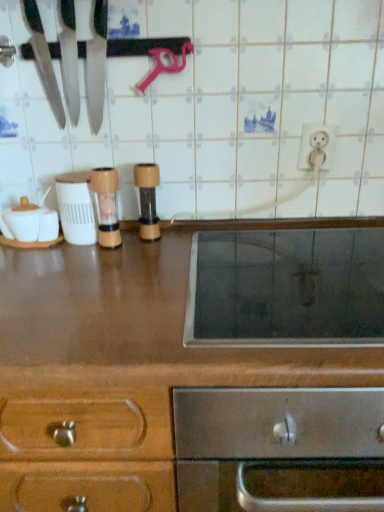
How much space does shiny silver knife at upper left, acting as the first knife starting from the left, occupy vertically?

shiny silver knife at upper left, acting as the first knife starting from the left, is 13.19 inches tall.

Describe the element at coordinates (42, 59) in the screenshot. I see `shiny silver knife at upper left, marked as the 2th knife in a right-to-left arrangement` at that location.

Measure the distance between wooden pepper grinder at center, the second appliance in the left-to-right sequence, and camera.

A distance of 36.05 inches exists between wooden pepper grinder at center, the second appliance in the left-to-right sequence, and camera.

The width and height of the screenshot is (384, 512). What do you see at coordinates (69, 57) in the screenshot? I see `shiny silver knife at upper left, which ranks as the 2th knife in left-to-right order` at bounding box center [69, 57].

What is the approximate height of white plastic container at center, which is the first appliance from left to right?

The height of white plastic container at center, which is the first appliance from left to right, is 6.97 inches.

The width and height of the screenshot is (384, 512). Describe the element at coordinates (317, 147) in the screenshot. I see `white glossy electric outlet at upper right` at that location.

What do you see at coordinates (147, 199) in the screenshot?
I see `brown wood pepper grinder at center, which appears as the third appliance when viewed from the left` at bounding box center [147, 199].

Where is `shiny silver knife at upper left, marked as the 2th knife in a right-to-left arrangement`? shiny silver knife at upper left, marked as the 2th knife in a right-to-left arrangement is located at coordinates (42, 59).

Considering the sizes of objects white glossy electric outlet at upper right and wooden pepper grinder at center, the second appliance in the left-to-right sequence, in the image provided, who is wider, white glossy electric outlet at upper right or wooden pepper grinder at center, the second appliance in the left-to-right sequence,?

With larger width is wooden pepper grinder at center, the second appliance in the left-to-right sequence.

Is white glossy electric outlet at upper right shorter than wooden pepper grinder at center, placed as the second appliance when sorted from right to left?

Correct, white glossy electric outlet at upper right is not as tall as wooden pepper grinder at center, placed as the second appliance when sorted from right to left.

Looking at this image, from the image's perspective, which is below, white glossy electric outlet at upper right or wooden pepper grinder at center, placed as the second appliance when sorted from right to left?

wooden pepper grinder at center, placed as the second appliance when sorted from right to left, from the image's perspective.

Based on their positions, is white glossy electric outlet at upper right located to the left or right of wooden pepper grinder at center, placed as the second appliance when sorted from right to left?

Based on their positions, white glossy electric outlet at upper right is located to the right of wooden pepper grinder at center, placed as the second appliance when sorted from right to left.

From a real-world perspective, which is physically above, shiny silver knife at upper left, marked as the 2th knife in a right-to-left arrangement, or shiny silver knife at upper left, which is counted as the 1th knife, starting from the right?

shiny silver knife at upper left, marked as the 2th knife in a right-to-left arrangement, from a real-world perspective.

Is shiny silver knife at upper left, acting as the first knife starting from the left, far away from shiny silver knife at upper left, which is counted as the 1th knife, starting from the right?

No.

Is shiny silver knife at upper left, marked as the 2th knife in a right-to-left arrangement, aimed at shiny silver knife at upper left, which is counted as the 1th knife, starting from the right?

No.

Which object is further away from the camera taking this photo, shiny silver knife at upper left, which ranks as the 2th knife in left-to-right order, or stainless steel oven at center?

shiny silver knife at upper left, which ranks as the 2th knife in left-to-right order, is further away from the camera.

Based on the photo, how far apart are shiny silver knife at upper left, which ranks as the 2th knife in left-to-right order, and stainless steel oven at center?

shiny silver knife at upper left, which ranks as the 2th knife in left-to-right order, is 63.90 centimeters away from stainless steel oven at center.

How many degrees apart are the facing directions of shiny silver knife at upper left, which ranks as the 2th knife in left-to-right order, and stainless steel oven at center?

shiny silver knife at upper left, which ranks as the 2th knife in left-to-right order, and stainless steel oven at center are facing 2.34 degrees away from each other.

From the image's perspective, which object appears higher, shiny silver knife at upper left, which is counted as the 1th knife, starting from the right, or stainless steel oven at center?

From the image's view, shiny silver knife at upper left, which is counted as the 1th knife, starting from the right, is above.

From a real-world perspective, is stainless steel oven at center over shiny silver knife at upper left, acting as the first knife starting from the left?

Actually, stainless steel oven at center is physically below shiny silver knife at upper left, acting as the first knife starting from the left, in the real world.

Is stainless steel oven at center behind shiny silver knife at upper left, acting as the first knife starting from the left?

No, it is not.

Which of these two, stainless steel oven at center or shiny silver knife at upper left, acting as the first knife starting from the left, is wider?

stainless steel oven at center.

From the image's perspective, is stainless steel oven at center above or below shiny silver knife at upper left, acting as the first knife starting from the left?

Clearly, from the image's perspective, stainless steel oven at center is below shiny silver knife at upper left, acting as the first knife starting from the left.

Relative to wooden pepper grinder at center, the second appliance in the left-to-right sequence, is brown wood pepper grinder at center, the first appliance when ordered from right to left, in front or behind?

brown wood pepper grinder at center, the first appliance when ordered from right to left, is behind wooden pepper grinder at center, the second appliance in the left-to-right sequence.

Would you say brown wood pepper grinder at center, which appears as the third appliance when viewed from the left, is to the left or to the right of wooden pepper grinder at center, placed as the second appliance when sorted from right to left, in the picture?

Clearly, brown wood pepper grinder at center, which appears as the third appliance when viewed from the left, is on the right of wooden pepper grinder at center, placed as the second appliance when sorted from right to left, in the image.

Looking at this image, from their relative heights in the image, would you say brown wood pepper grinder at center, the first appliance when ordered from right to left, is taller or shorter than wooden pepper grinder at center, the second appliance in the left-to-right sequence?

In the image, brown wood pepper grinder at center, the first appliance when ordered from right to left, appears to be taller than wooden pepper grinder at center, the second appliance in the left-to-right sequence.

From the image's perspective, is brown wood pepper grinder at center, which appears as the third appliance when viewed from the left, located above or below wooden pepper grinder at center, placed as the second appliance when sorted from right to left?

brown wood pepper grinder at center, which appears as the third appliance when viewed from the left, is situated higher than wooden pepper grinder at center, placed as the second appliance when sorted from right to left, in the image.

In the image, is white glossy electric outlet at upper right positioned in front of or behind white plastic container at center, which is the first appliance from left to right?

In the image, white glossy electric outlet at upper right appears behind white plastic container at center, which is the first appliance from left to right.

How different are the orientations of white glossy electric outlet at upper right and white plastic container at center, which is the first appliance from left to right, in degrees?

The angle between the facing direction of white glossy electric outlet at upper right and the facing direction of white plastic container at center, which is the first appliance from left to right, is 2.14 degrees.

Looking at this image, could you tell me if white glossy electric outlet at upper right is turned towards white plastic container at center, placed as the 3th appliance when sorted from right to left?

No, white glossy electric outlet at upper right is not aimed at white plastic container at center, placed as the 3th appliance when sorted from right to left.

Are shiny silver knife at upper left, marked as the 2th knife in a right-to-left arrangement, and wooden pepper grinder at center, placed as the second appliance when sorted from right to left, beside each other?

shiny silver knife at upper left, marked as the 2th knife in a right-to-left arrangement, and wooden pepper grinder at center, placed as the second appliance when sorted from right to left, are clearly separated.

Considering the sizes of objects shiny silver knife at upper left, marked as the 2th knife in a right-to-left arrangement, and wooden pepper grinder at center, placed as the second appliance when sorted from right to left, in the image provided, who is wider, shiny silver knife at upper left, marked as the 2th knife in a right-to-left arrangement, or wooden pepper grinder at center, placed as the second appliance when sorted from right to left,?

Wider between the two is shiny silver knife at upper left, marked as the 2th knife in a right-to-left arrangement.

Can wooden pepper grinder at center, placed as the second appliance when sorted from right to left, be found inside shiny silver knife at upper left, acting as the first knife starting from the left?

No, shiny silver knife at upper left, acting as the first knife starting from the left, does not contain wooden pepper grinder at center, placed as the second appliance when sorted from right to left.

Identify the location of electric outlet above the wooden pepper grinder at center, the second appliance in the left-to-right sequence (from the image's perspective). (317, 147).

Find the location of a particular element. This screenshot has width=384, height=512. knife that is on the right side of shiny silver knife at upper left, marked as the 2th knife in a right-to-left arrangement is located at coordinates (69, 57).

From the image, which object appears to be nearer to wooden pepper grinder at center, placed as the second appliance when sorted from right to left, white glossy electric outlet at upper right or stainless steel oven at center?

stainless steel oven at center is closer to wooden pepper grinder at center, placed as the second appliance when sorted from right to left.

Based on their spatial positions, is white plastic container at center, placed as the 3th appliance when sorted from right to left, or shiny silver knife at upper left, which ranks as the 2th knife in left-to-right order, closer to stainless steel oven at center?

Based on the image, white plastic container at center, placed as the 3th appliance when sorted from right to left, appears to be nearer to stainless steel oven at center.

Considering their positions, is wooden pepper grinder at center, placed as the second appliance when sorted from right to left, positioned further to smooth glass cooktop at center than shiny silver knife at upper left, acting as the first knife starting from the left?

Among the two, shiny silver knife at upper left, acting as the first knife starting from the left, is located further to smooth glass cooktop at center.

Based on their spatial positions, is white glossy electric outlet at upper right or shiny silver knife at upper left, marked as the 2th knife in a right-to-left arrangement, closer to white plastic container at center, which is the first appliance from left to right?

shiny silver knife at upper left, marked as the 2th knife in a right-to-left arrangement, is closer to white plastic container at center, which is the first appliance from left to right.

Considering their positions, is brown wood pepper grinder at center, which appears as the third appliance when viewed from the left, positioned closer to wooden pepper grinder at center, the second appliance in the left-to-right sequence, than white glossy electric outlet at upper right?

brown wood pepper grinder at center, which appears as the third appliance when viewed from the left.

Based on their spatial positions, is smooth glass cooktop at center or wooden pepper grinder at center, the second appliance in the left-to-right sequence, further from stainless steel oven at center?

wooden pepper grinder at center, the second appliance in the left-to-right sequence, is positioned further to the anchor stainless steel oven at center.

Estimate the real-world distances between objects in this image. Which object is closer to smooth glass cooktop at center, white plastic container at center, which is the first appliance from left to right, or shiny silver knife at upper left, which is counted as the 1th knife, starting from the right?

white plastic container at center, which is the first appliance from left to right.

From the image, which object appears to be nearer to white plastic container at center, placed as the 3th appliance when sorted from right to left, wooden pepper grinder at center, the second appliance in the left-to-right sequence, or brown wood pepper grinder at center, which appears as the third appliance when viewed from the left?

Based on the image, wooden pepper grinder at center, the second appliance in the left-to-right sequence, appears to be nearer to white plastic container at center, placed as the 3th appliance when sorted from right to left.

The image size is (384, 512). Identify the location of knife between shiny silver knife at upper left, acting as the first knife starting from the left, and smooth glass cooktop at center, in the horizontal direction. (69, 57).

This screenshot has height=512, width=384. I want to click on kitchen appliance that lies between brown wood pepper grinder at center, the first appliance when ordered from right to left, and stainless steel oven at center from top to bottom, so [x=286, y=288].

The width and height of the screenshot is (384, 512). Identify the location of knife between shiny silver knife at upper left, which is counted as the 1th knife, starting from the right, and white plastic container at center, placed as the 3th appliance when sorted from right to left, vertically. pyautogui.click(x=42, y=59).

Identify the location of knife between shiny silver knife at upper left, which is counted as the 1th knife, starting from the right, and stainless steel oven at center, in the vertical direction. (42, 59).